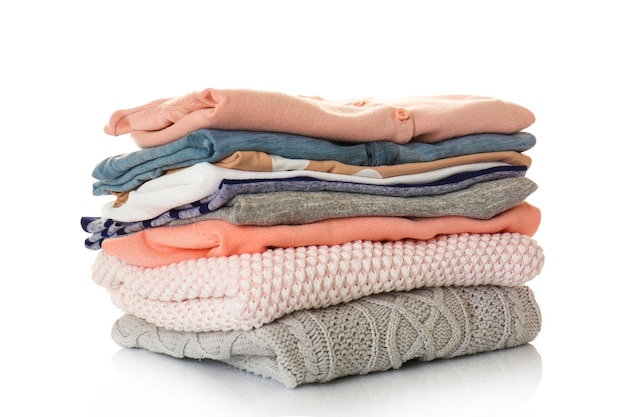
Find the location of a particular element. The height and width of the screenshot is (417, 626). folded laundry is located at coordinates (332, 119), (331, 142), (322, 164), (327, 173), (327, 183), (325, 199), (322, 226), (320, 271), (341, 326).